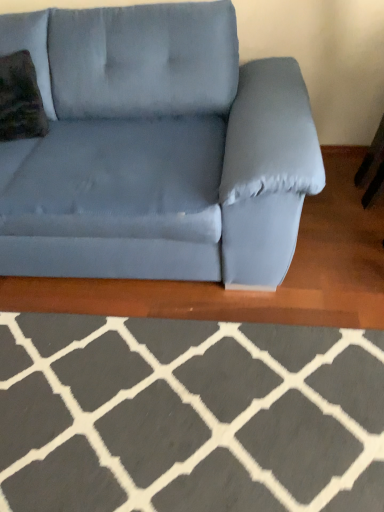
What do you see at coordinates (188, 415) in the screenshot? I see `gray wool rug at lower center` at bounding box center [188, 415].

At what (x,y) coordinates should I click in order to perform the action: click on gray wool rug at lower center. Please return your answer as a coordinate pair (x, y). Looking at the image, I should click on (188, 415).

Is the position of suede blue couch at center more distant than that of velvety green throw pillow at upper left?

No, the depth of suede blue couch at center is less than that of velvety green throw pillow at upper left.

From the image's perspective, is suede blue couch at center located above velvety green throw pillow at upper left?

No, from the image's perspective, suede blue couch at center is not above velvety green throw pillow at upper left.

Considering the sizes of suede blue couch at center and velvety green throw pillow at upper left in the image, is suede blue couch at center taller or shorter than velvety green throw pillow at upper left?

suede blue couch at center is taller than velvety green throw pillow at upper left.

From a real-world perspective, is suede blue couch at center beneath velvety green throw pillow at upper left?

Yes, from a real-world perspective, suede blue couch at center is under velvety green throw pillow at upper left.

Is gray wool rug at lower center positioned before suede blue couch at center?

Yes, the depth of gray wool rug at lower center is less than that of suede blue couch at center.

Consider the image. Which object is wider, gray wool rug at lower center or suede blue couch at center?

gray wool rug at lower center is wider.

How many degrees apart are the facing directions of gray wool rug at lower center and suede blue couch at center?

They differ by 91.9 degrees in their facing directions.

Is velvety green throw pillow at upper left next to gray wool rug at lower center?

velvety green throw pillow at upper left and gray wool rug at lower center are clearly separated.

Can we say velvety green throw pillow at upper left lies outside gray wool rug at lower center?

velvety green throw pillow at upper left is positioned outside gray wool rug at lower center.

Can you confirm if velvety green throw pillow at upper left is shorter than gray wool rug at lower center?

In fact, velvety green throw pillow at upper left may be taller than gray wool rug at lower center.

Which object is positioned more to the left, velvety green throw pillow at upper left or gray wool rug at lower center?

velvety green throw pillow at upper left is more to the left.

Consider the image. Can you confirm if velvety green throw pillow at upper left is positioned to the right of suede blue couch at center?

No, velvety green throw pillow at upper left is not to the right of suede blue couch at center.

How far apart are velvety green throw pillow at upper left and suede blue couch at center?

velvety green throw pillow at upper left and suede blue couch at center are 19.15 inches apart from each other.

Looking at this image, does velvety green throw pillow at upper left have a lesser width compared to suede blue couch at center?

Indeed, velvety green throw pillow at upper left has a lesser width compared to suede blue couch at center.

Is velvety green throw pillow at upper left shorter than suede blue couch at center?

Yes.

Which is closer to the camera, (42, 86) or (333, 383)?

Point (42, 86) is farther from the camera than point (333, 383).

Would you say suede blue couch at center is inside or outside gray wool rug at lower center?

suede blue couch at center is outside gray wool rug at lower center.

From the picture: From the image's perspective, would you say suede blue couch at center is shown under gray wool rug at lower center?

No, from the image's perspective, suede blue couch at center is not below gray wool rug at lower center.

Between suede blue couch at center and gray wool rug at lower center, which one has larger size?

suede blue couch at center is bigger.

Which of these two, gray wool rug at lower center or velvety green throw pillow at upper left, is smaller?

velvety green throw pillow at upper left.

Is the depth of gray wool rug at lower center greater than that of velvety green throw pillow at upper left?

No, it is not.

Which is more to the left, gray wool rug at lower center or velvety green throw pillow at upper left?

velvety green throw pillow at upper left.

Does point (22, 339) come behind point (7, 98)?

That is False.

Find the location of `throw pillow that appears above the suede blue couch at center (from the image's perspective)`. throw pillow that appears above the suede blue couch at center (from the image's perspective) is located at coordinates (20, 99).

At what (x,y) coordinates should I click in order to perform the action: click on furniture directly beneath the suede blue couch at center (from a real-world perspective). Please return your answer as a coordinate pair (x, y). The image size is (384, 512). Looking at the image, I should click on (188, 415).

From the picture: When comparing their distances from suede blue couch at center, does velvety green throw pillow at upper left or gray wool rug at lower center seem closer?

velvety green throw pillow at upper left is closer to suede blue couch at center.

From the image, which object appears to be nearer to velvety green throw pillow at upper left, suede blue couch at center or gray wool rug at lower center?

The object closer to velvety green throw pillow at upper left is suede blue couch at center.

When comparing their distances from suede blue couch at center, does gray wool rug at lower center or velvety green throw pillow at upper left seem closer?

The object closer to suede blue couch at center is velvety green throw pillow at upper left.

Based on the photo, considering their positions, is velvety green throw pillow at upper left positioned further to gray wool rug at lower center than suede blue couch at center?

The object further to gray wool rug at lower center is velvety green throw pillow at upper left.

When comparing their distances from gray wool rug at lower center, does suede blue couch at center or velvety green throw pillow at upper left seem further?

Among the two, velvety green throw pillow at upper left is located further to gray wool rug at lower center.

Looking at the image, which one is located further to velvety green throw pillow at upper left, gray wool rug at lower center or suede blue couch at center?

gray wool rug at lower center is further to velvety green throw pillow at upper left.

Identify the location of studio couch between velvety green throw pillow at upper left and gray wool rug at lower center in the vertical direction. (157, 150).